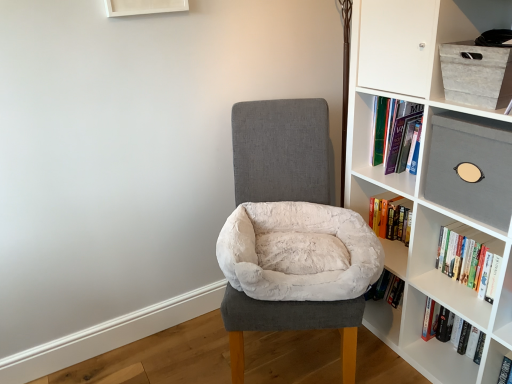
Locate an element on the screen. The width and height of the screenshot is (512, 384). vacant area situated below white plush pet bed at center (from a real-world perspective) is located at coordinates (290, 351).